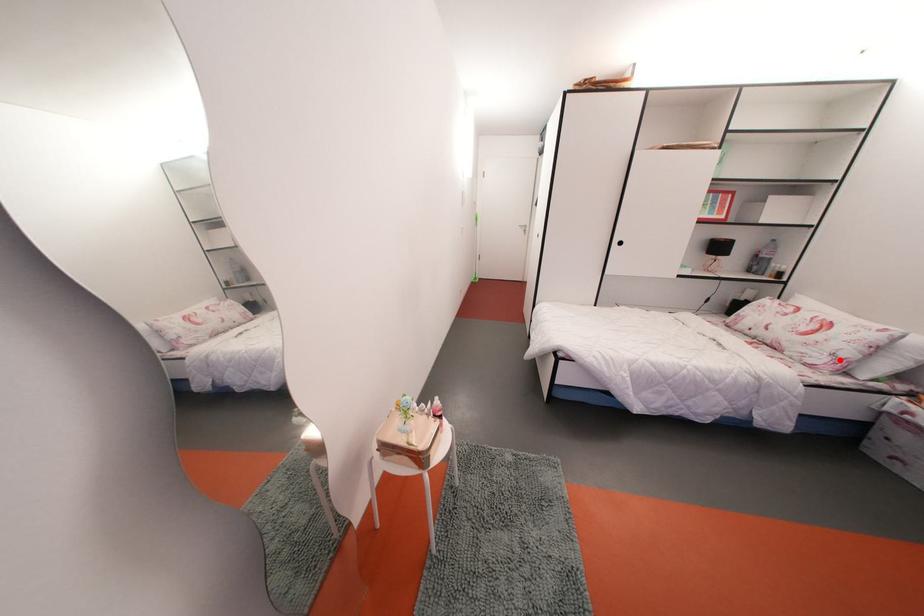
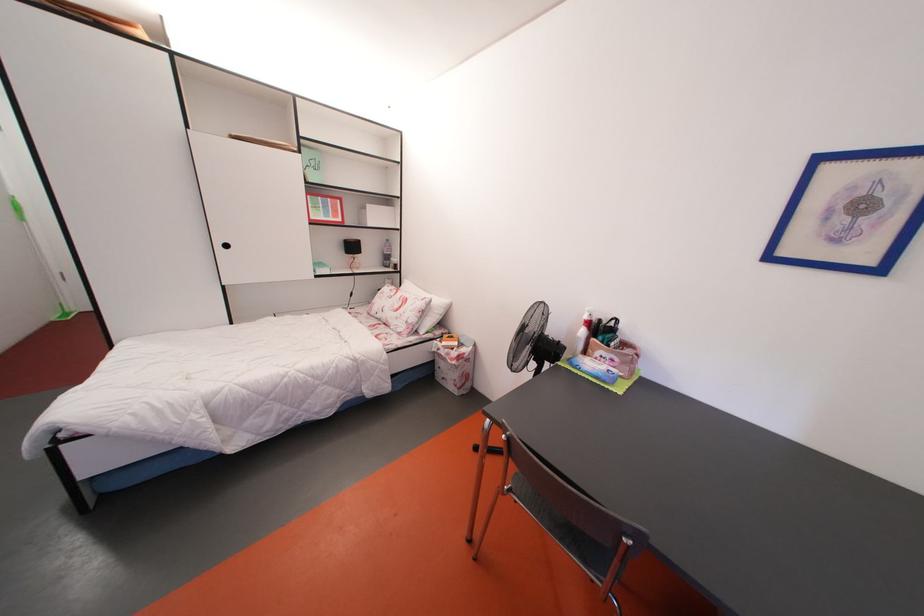
Where in the second image is the point corresponding to the highlighted location from the first image?

(414, 328)